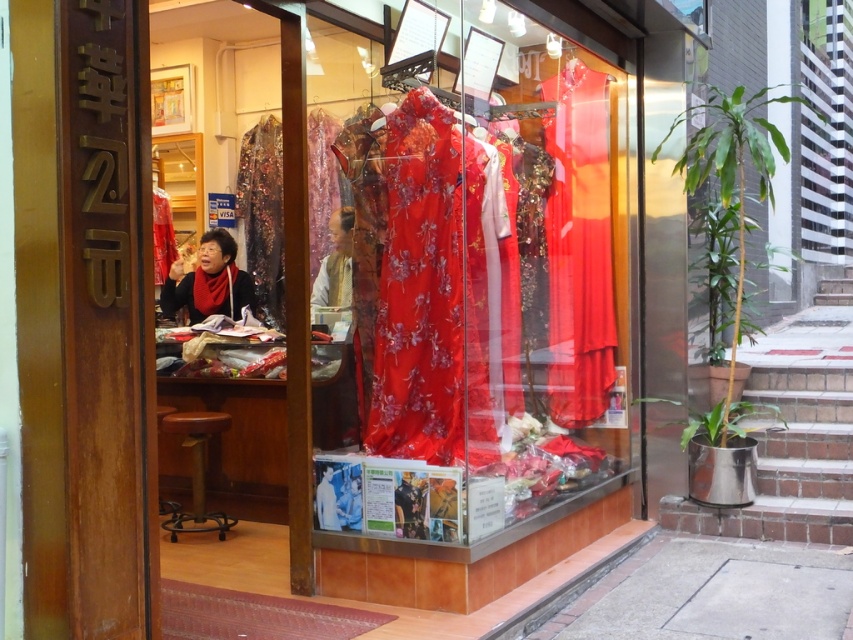
Question: Can you confirm if silky red dress at center is bigger than silky white blouse at center?

Choices:
 (A) no
 (B) yes

Answer: (A)

Question: From the image, what is the correct spatial relationship of silky white blouse at center in relation to black satin blouse at center?

Choices:
 (A) left
 (B) right

Answer: (B)

Question: Considering the real-world distances, which object is closest to the black satin blouse at center?

Choices:
 (A) silky red dress at center
 (B) silky white blouse at center

Answer: (B)

Question: Which object is farther from the camera taking this photo?

Choices:
 (A) silky red dress at center
 (B) black satin blouse at center
 (C) silky white blouse at center

Answer: (B)

Question: Is silky white blouse at center to the left of black satin blouse at center from the viewer's perspective?

Choices:
 (A) yes
 (B) no

Answer: (B)

Question: Which object is the farthest from the silky red dress at center?

Choices:
 (A) black satin blouse at center
 (B) silky white blouse at center

Answer: (A)